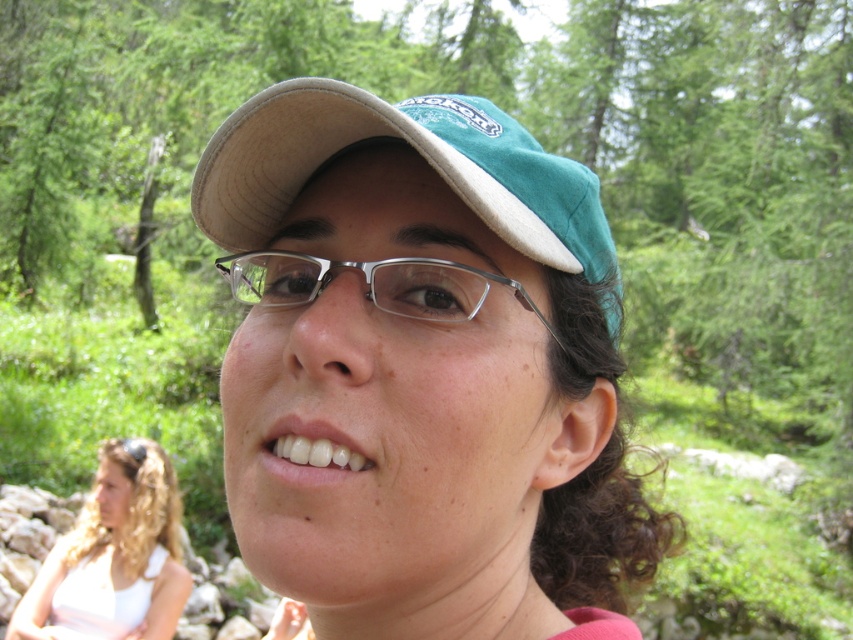
You are a photographer trying to capture a portrait of the person wearing a green baseball cap with a beige brim. The subject is standing at point (260, 413). If you want to ensure the background remains blurred, what should you adjust on your camera?

To keep the background blurred while focusing on the subject at point (260, 413), you should use a wide aperture setting on your camera. This will create a shallow depth of field, ensuring the subject remains sharp while the background stays out of focus.

You are trying to decide which object to grab first between the green fabric baseball cap at center and the blonde hair at lower left. If you can only reach objects wider than 15 cm, which one should you choose?

The green fabric baseball cap at center has a width less than the blonde hair at lower left. Since the blonde hair at lower left is wider than the cap, and assuming it meets the 15 cm requirement, you should choose the blonde hair at lower left.

You are a photographer trying to capture a close detail shot of the green suede cap at center and the clear plastic glasses at center. Your camera has a minimum focus distance of 3 inches. Can you focus on both objects simultaneously without moving the camera?

The green suede cap at center and clear plastic glasses at center are 3.08 inches apart. Since the minimum focus distance is 3 inches, the camera can focus on both objects as they are within the required distance.